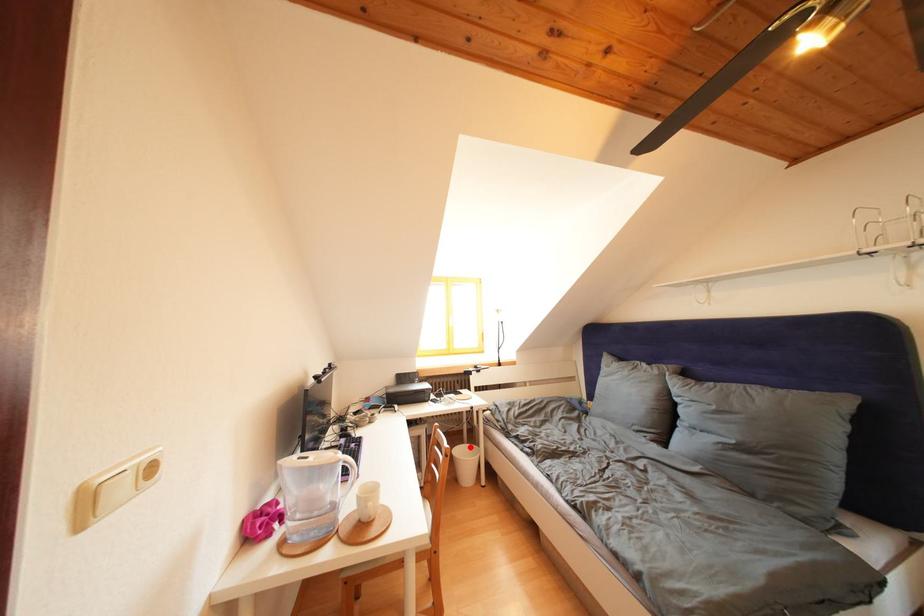
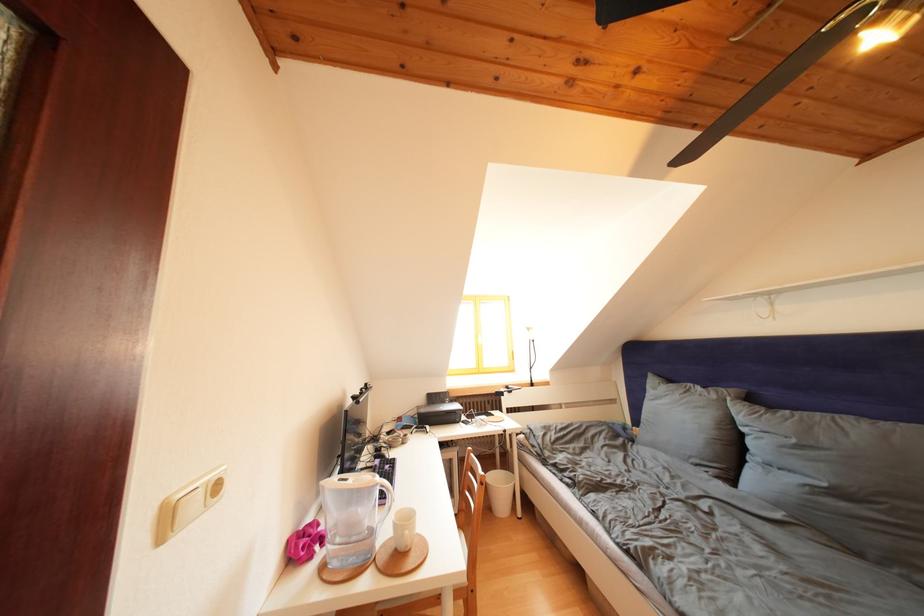
Question: I am providing you with two images of the same scene from different viewpoints. A red point is marked on the first image. Is the red point's position out of view in image 2?

Choices:
 (A) Yes
 (B) No

Answer: (B)